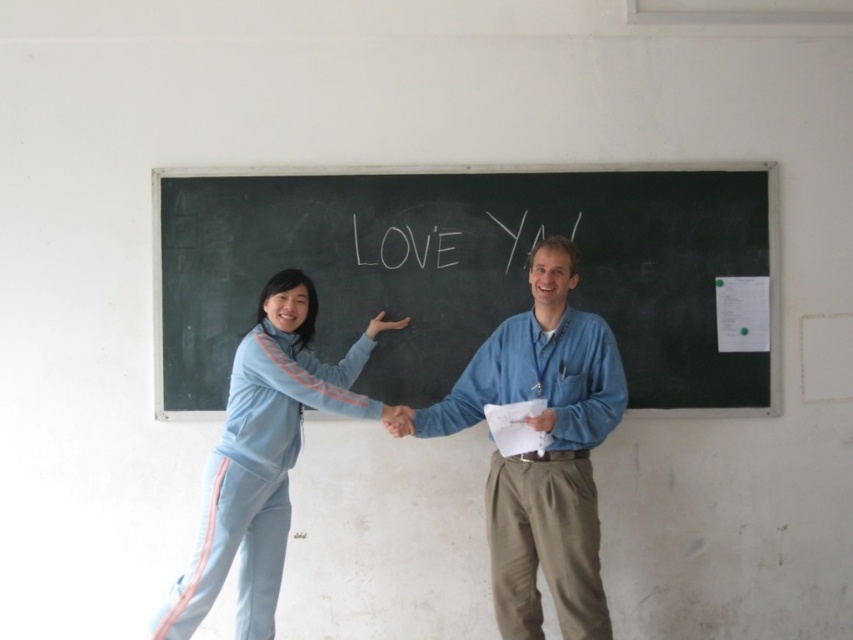
You are a student who needs to hand in an assignment. You see the white paper at center and the blue denim shirt at center. Which object is wider?

The white paper at center is wider than the blue denim shirt at center.

Based on the scene description, which object is taller between the blue denim shirt at center and the light blue fabric pants at left?

The blue denim shirt at center is much taller than the light blue fabric pants at left.

You are a photographer trying to capture a candid shot of the light blue fabric pants at left and the white paper at center. If your camera has a depth of field that can focus on objects within 20 inches of each other, will both subjects be in focus?

The white paper at center is 23.43 inches away from the light blue fabric pants at left. Since the distance between them exceeds the camera lens depth of field range of 20 inches, both subjects cannot be in focus simultaneously.